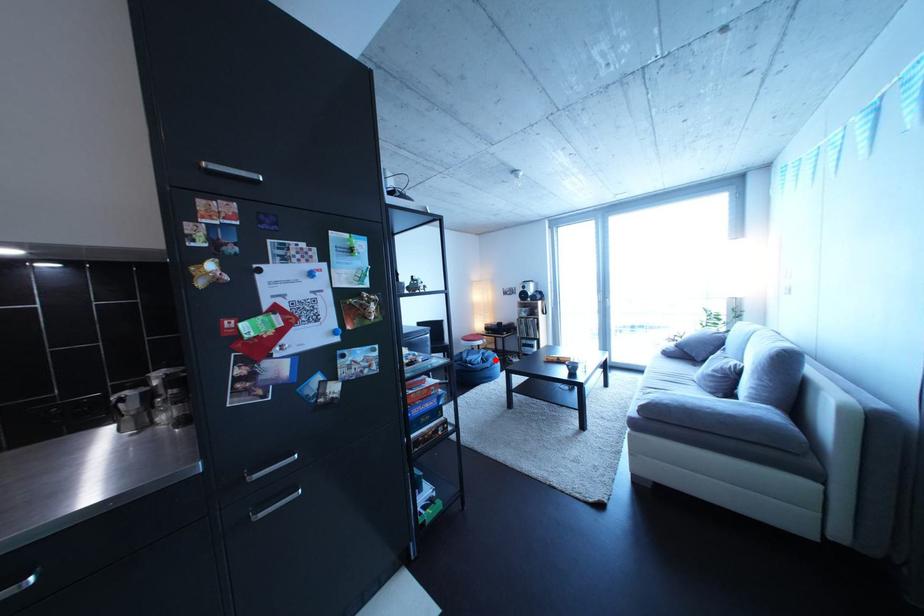
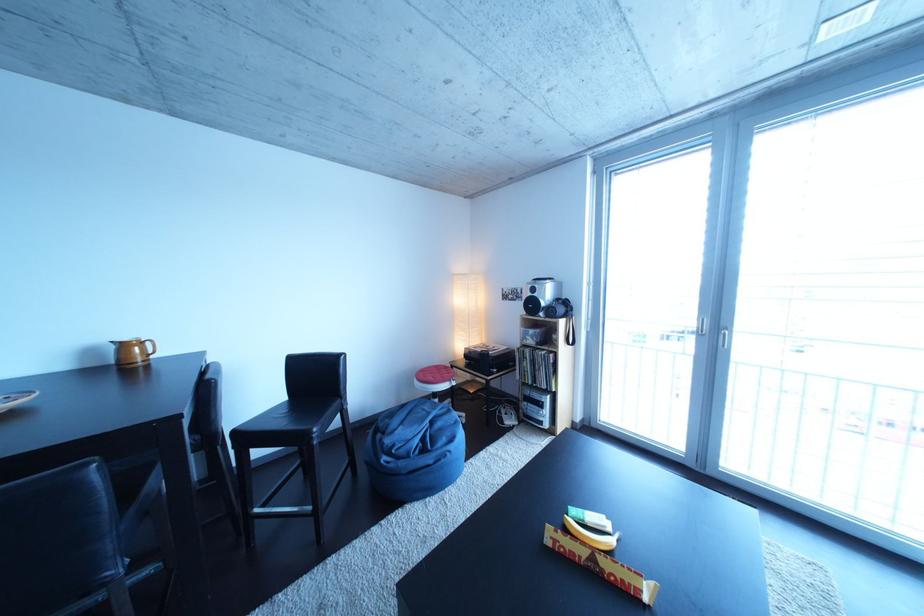
Find the pixel in the second image that matches the highlighted location in the first image.

(444, 428)